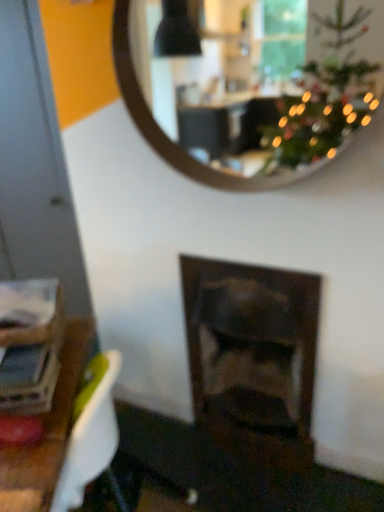
What do you see at coordinates (250, 87) in the screenshot? I see `wooden mirror at upper center` at bounding box center [250, 87].

Where is `wooden mirror at upper center`? wooden mirror at upper center is located at coordinates (250, 87).

What do you see at coordinates (253, 357) in the screenshot? I see `dark wood fireplace at center` at bounding box center [253, 357].

In order to face dark wood fireplace at center, should I rotate leftwards or rightwards?

Rotate right and turn 7.352 degrees.

Where is `dark wood fireplace at center`? dark wood fireplace at center is located at coordinates (253, 357).

Identify the location of wooden mirror at upper center. (250, 87).

Based on their positions, is dark wood fireplace at center located to the left or right of wooden mirror at upper center?

Clearly, dark wood fireplace at center is on the right of wooden mirror at upper center in the image.

Is the position of dark wood fireplace at center more distant than that of wooden mirror at upper center?

Yes, dark wood fireplace at center is further from the camera.

Considering the positions of points (263, 298) and (174, 157), is point (263, 298) closer to camera compared to point (174, 157)?

That is False.

From the image's perspective, between dark wood fireplace at center and wooden mirror at upper center, who is located below?

dark wood fireplace at center appears lower in the image.

From a real-world perspective, is dark wood fireplace at center on top of wooden mirror at upper center?

No, from a real-world perspective, dark wood fireplace at center is not over wooden mirror at upper center

Considering the relative sizes of dark wood fireplace at center and wooden mirror at upper center in the image provided, is dark wood fireplace at center thinner than wooden mirror at upper center?

In fact, dark wood fireplace at center might be wider than wooden mirror at upper center.

Considering the relative sizes of dark wood fireplace at center and wooden mirror at upper center in the image provided, is dark wood fireplace at center taller than wooden mirror at upper center?

Indeed, dark wood fireplace at center has a greater height compared to wooden mirror at upper center.

Considering the relative sizes of dark wood fireplace at center and wooden mirror at upper center in the image provided, is dark wood fireplace at center smaller than wooden mirror at upper center?

Incorrect, dark wood fireplace at center is not smaller in size than wooden mirror at upper center.

Is dark wood fireplace at center not inside wooden mirror at upper center?

dark wood fireplace at center is positioned outside wooden mirror at upper center.

Is dark wood fireplace at center with wooden mirror at upper center?

No, dark wood fireplace at center is not making contact with wooden mirror at upper center.

Could you tell me if dark wood fireplace at center is facing wooden mirror at upper center?

No, dark wood fireplace at center is not aimed at wooden mirror at upper center.

How many degrees apart are the facing directions of dark wood fireplace at center and wooden mirror at upper center?

1.09 degrees.

Measure the distance between dark wood fireplace at center and wooden mirror at upper center.

A distance of 7.76 feet exists between dark wood fireplace at center and wooden mirror at upper center.

You are a GUI agent. You are given a task and a screenshot of the screen. Output one action in this format:
    pyautogui.click(x=<x>, y=<y>)
    Task: Click on the fireplace behind the wooden mirror at upper center
    
    Given the screenshot: What is the action you would take?
    pyautogui.click(x=253, y=357)

In the scene shown: Visually, is wooden mirror at upper center positioned to the left or to the right of dark wood fireplace at center?

In the image, wooden mirror at upper center appears on the left side of dark wood fireplace at center.

Which is in front, wooden mirror at upper center or dark wood fireplace at center?

wooden mirror at upper center.

Does point (280, 135) lie behind point (189, 286)?

Yes, it is behind point (189, 286).

From the image's perspective, between wooden mirror at upper center and dark wood fireplace at center, who is located below?

dark wood fireplace at center, from the image's perspective.

From a real-world perspective, is wooden mirror at upper center above or below dark wood fireplace at center?

From a real-world perspective, wooden mirror at upper center is physically above dark wood fireplace at center.

Is wooden mirror at upper center wider or thinner than dark wood fireplace at center?

wooden mirror at upper center is thinner than dark wood fireplace at center.

Is wooden mirror at upper center taller or shorter than dark wood fireplace at center?

Considering their sizes, wooden mirror at upper center has less height than dark wood fireplace at center.

Does wooden mirror at upper center have a smaller size compared to dark wood fireplace at center?

Indeed, wooden mirror at upper center has a smaller size compared to dark wood fireplace at center.

Does wooden mirror at upper center contain dark wood fireplace at center?

Definitely not — dark wood fireplace at center is not inside wooden mirror at upper center.

Is the surface of wooden mirror at upper center in direct contact with dark wood fireplace at center?

wooden mirror at upper center is not next to dark wood fireplace at center, and they're not touching.

Is wooden mirror at upper center oriented towards dark wood fireplace at center?

No, wooden mirror at upper center is not oriented towards dark wood fireplace at center.

How different are the orientations of wooden mirror at upper center and dark wood fireplace at center in degrees?

There is a 1.09-degree angle between the facing directions of wooden mirror at upper center and dark wood fireplace at center.

How far apart are wooden mirror at upper center and dark wood fireplace at center?

The distance of wooden mirror at upper center from dark wood fireplace at center is 7.76 feet.

The width and height of the screenshot is (384, 512). In order to click on mirror located in front of the dark wood fireplace at center in this screenshot , I will do `click(250, 87)`.

Locate an element on the screen. fireplace lying on the right of wooden mirror at upper center is located at coordinates (253, 357).

Where is `mirror that appears above the dark wood fireplace at center (from a real-world perspective)`? The width and height of the screenshot is (384, 512). mirror that appears above the dark wood fireplace at center (from a real-world perspective) is located at coordinates (250, 87).